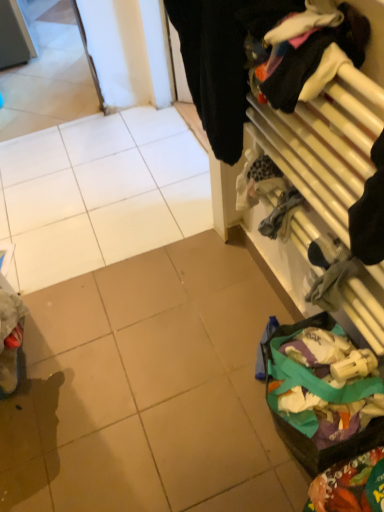
Question: Can you confirm if black fabric at upper right is positioned to the right of multicolored fabric at lower right, which appears as the 2th waste when viewed from the back?

Choices:
 (A) yes
 (B) no

Answer: (B)

Question: Does black fabric at upper right have a larger size compared to multicolored fabric at lower right, which appears as the 2th waste when viewed from the back?

Choices:
 (A) yes
 (B) no

Answer: (A)

Question: Is black fabric at upper right closer to camera compared to multicolored fabric at lower right, the first waste positioned from the front?

Choices:
 (A) yes
 (B) no

Answer: (A)

Question: Is black fabric at upper right positioned behind multicolored fabric at lower right, the first waste positioned from the front?

Choices:
 (A) no
 (B) yes

Answer: (A)

Question: Is black fabric at upper right thinner than multicolored fabric at lower right, which appears as the 2th waste when viewed from the back?

Choices:
 (A) yes
 (B) no

Answer: (B)

Question: Considering the positions of point (231, 41) and point (215, 53), is point (231, 41) closer or farther from the camera than point (215, 53)?

Choices:
 (A) farther
 (B) closer

Answer: (B)

Question: Is wooden rack at right in front of or behind black fabric at upper right in the image?

Choices:
 (A) front
 (B) behind

Answer: (A)

Question: Considering the positions of wooden rack at right and black fabric at upper right in the image, is wooden rack at right wider or thinner than black fabric at upper right?

Choices:
 (A) wide
 (B) thin

Answer: (B)

Question: Is wooden rack at right taller or shorter than black fabric at upper right?

Choices:
 (A) tall
 (B) short

Answer: (A)

Question: In the image, is black fabric at upper right on the left side or the right side of wooden rack at right?

Choices:
 (A) left
 (B) right

Answer: (A)

Question: Is black fabric at upper right wider or thinner than wooden rack at right?

Choices:
 (A) wide
 (B) thin

Answer: (A)

Question: Does point (256, 13) appear closer or farther from the camera than point (233, 47)?

Choices:
 (A) closer
 (B) farther

Answer: (A)

Question: In terms of height, does black fabric at upper right look taller or shorter compared to wooden rack at right?

Choices:
 (A) tall
 (B) short

Answer: (B)

Question: From a real-world perspective, relative to black fabric at upper right, is multicolored fabric at lower right, the first waste positioned from the front, vertically above or below?

Choices:
 (A) below
 (B) above

Answer: (A)

Question: From the image's perspective, is multicolored fabric at lower right, the first waste positioned from the front, located above or below black fabric at upper right?

Choices:
 (A) below
 (B) above

Answer: (A)